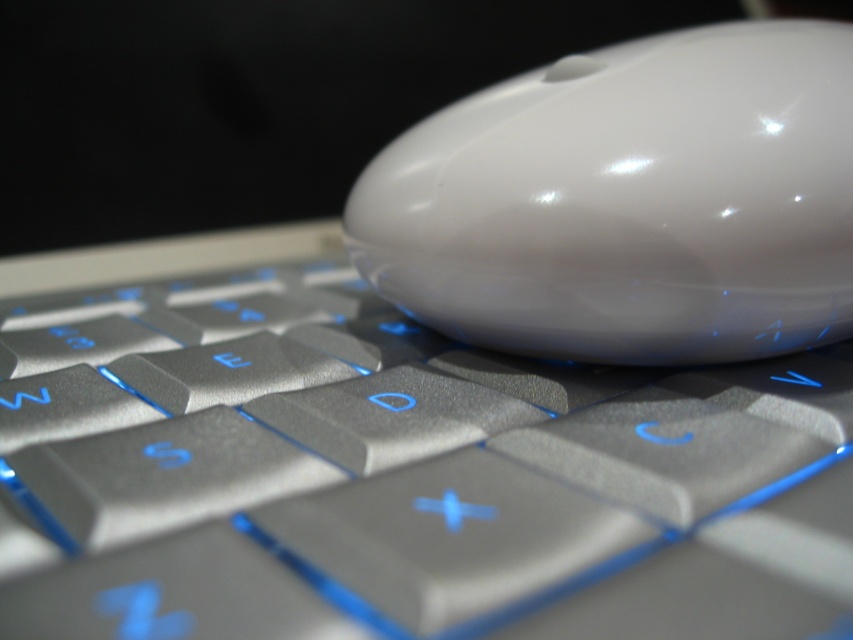
Question: Which of the following is the closest to the observer?

Choices:
 (A) white glossy mouse at upper center
 (B) satin silver keyboard at center

Answer: (B)

Question: In this image, where is satin silver keyboard at center located relative to white glossy mouse at upper center?

Choices:
 (A) above
 (B) below

Answer: (B)

Question: Can you confirm if satin silver keyboard at center is positioned above white glossy mouse at upper center?

Choices:
 (A) yes
 (B) no

Answer: (B)

Question: Which point is closer to the camera taking this photo?

Choices:
 (A) (717, 576)
 (B) (838, 120)

Answer: (A)

Question: Is satin silver keyboard at center in front of white glossy mouse at upper center?

Choices:
 (A) no
 (B) yes

Answer: (B)